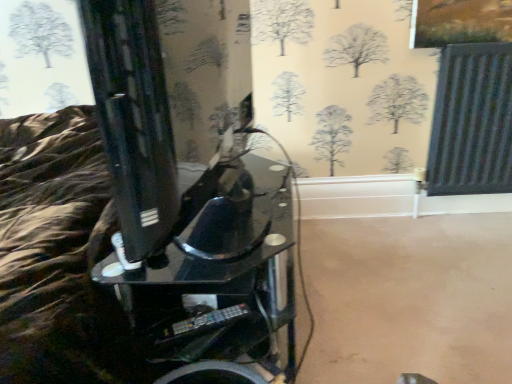
Question: Should I look upward or downward to see black glass coffee table at center?

Choices:
 (A) down
 (B) up

Answer: (A)